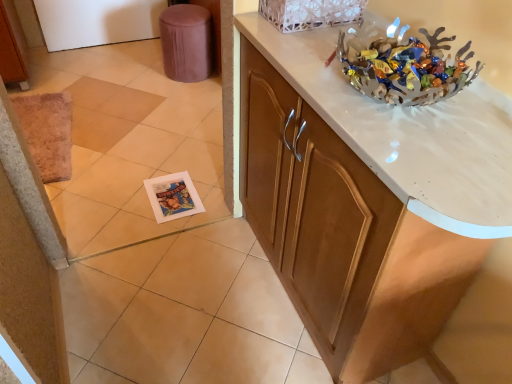
You are a GUI agent. You are given a task and a screenshot of the screen. Output one action in this format:
    pyautogui.click(x=<x>, y=<y>)
    Task: Click on the free location to the left of white marble countertop at upper right
    The width and height of the screenshot is (512, 384).
    Given the screenshot: What is the action you would take?
    pyautogui.click(x=190, y=299)